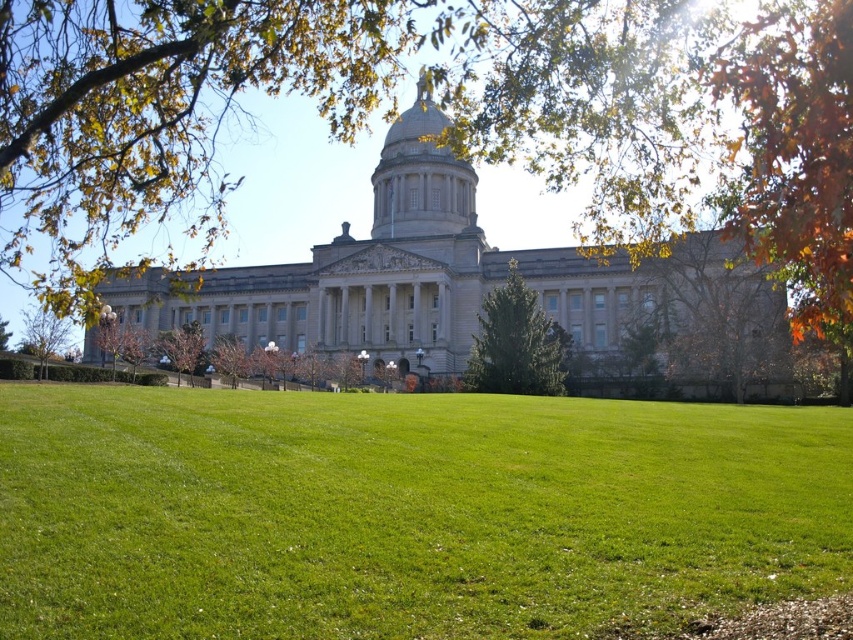
Question: Does green textured tree at center have a larger size compared to green leafy tree at left?

Choices:
 (A) no
 (B) yes

Answer: (A)

Question: Does green leafy tree at left appear over green leafy tree at center?

Choices:
 (A) no
 (B) yes

Answer: (B)

Question: Does green smooth grass at center appear under green leafy tree at lower left?

Choices:
 (A) no
 (B) yes

Answer: (B)

Question: Which is nearer to the green leafy tree at left?

Choices:
 (A) green smooth grass at center
 (B) green leafy tree at center
 (C) green textured tree at center
 (D) green leafy tree at lower left

Answer: (D)

Question: Among these objects, which one is nearest to the camera?

Choices:
 (A) green leafy tree at left
 (B) green textured tree at center

Answer: (A)

Question: Which point is farther to the camera?

Choices:
 (A) (196, 337)
 (B) (314, 452)
 (C) (71, 330)
 (D) (239, 342)

Answer: (C)